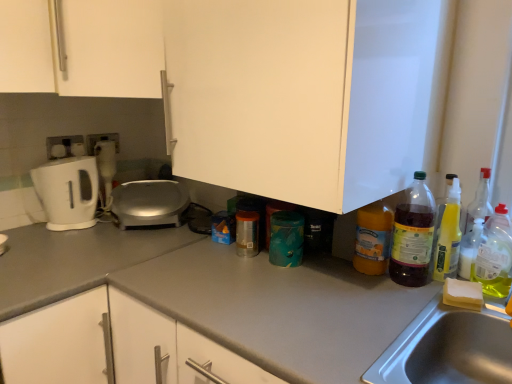
Question: Is translucent plastic spray bottle at right, which is the 3th bottle in left-to-right order, directly adjacent to yellow translucent spray bottle at right, which is the second bottle from right to left?

Choices:
 (A) no
 (B) yes

Answer: (B)

Question: From the image's perspective, does translucent plastic spray bottle at right, the third bottle in the right-to-left sequence, appear lower than yellow translucent spray bottle at right, which is the second bottle from right to left?

Choices:
 (A) yes
 (B) no

Answer: (B)

Question: From the image's perspective, would you say translucent plastic spray bottle at right, the third bottle in the right-to-left sequence, is positioned over yellow translucent spray bottle at right, which ranks as the fourth bottle in left-to-right order?

Choices:
 (A) yes
 (B) no

Answer: (A)

Question: From a real-world perspective, is translucent plastic spray bottle at right, the third bottle in the right-to-left sequence, located beneath yellow translucent spray bottle at right, which ranks as the fourth bottle in left-to-right order?

Choices:
 (A) yes
 (B) no

Answer: (B)

Question: Is translucent plastic spray bottle at right, which is the 3th bottle in left-to-right order, completely or partially outside of yellow translucent spray bottle at right, which ranks as the fourth bottle in left-to-right order?

Choices:
 (A) no
 (B) yes

Answer: (B)

Question: From a real-world perspective, is white glossy electric kettle at left physically located above or below translucent plastic bottle at right, placed as the second bottle when sorted from left to right?

Choices:
 (A) above
 (B) below

Answer: (B)

Question: Considering the positions of white glossy electric kettle at left and translucent plastic bottle at right, placed as the second bottle when sorted from left to right, in the image, is white glossy electric kettle at left wider or thinner than translucent plastic bottle at right, placed as the second bottle when sorted from left to right,?

Choices:
 (A) thin
 (B) wide

Answer: (B)

Question: Is white glossy electric kettle at left inside or outside of translucent plastic bottle at right, placed as the second bottle when sorted from left to right?

Choices:
 (A) outside
 (B) inside

Answer: (A)

Question: Is point (79, 208) closer or farther from the camera than point (413, 261)?

Choices:
 (A) closer
 (B) farther

Answer: (B)

Question: From a real-world perspective, is satin silver appliance at center positioned above or below white glossy electric kettle at left?

Choices:
 (A) above
 (B) below

Answer: (B)

Question: From the image's perspective, relative to white glossy electric kettle at left, is satin silver appliance at center above or below?

Choices:
 (A) below
 (B) above

Answer: (A)

Question: Considering the positions of satin silver appliance at center and white glossy electric kettle at left in the image, is satin silver appliance at center wider or thinner than white glossy electric kettle at left?

Choices:
 (A) thin
 (B) wide

Answer: (B)

Question: Does point (132, 190) appear closer or farther from the camera than point (49, 200)?

Choices:
 (A) closer
 (B) farther

Answer: (B)

Question: Is point (26, 52) closer or farther from the camera than point (472, 251)?

Choices:
 (A) farther
 (B) closer

Answer: (B)

Question: From a real-world perspective, is white matte cabinet at upper left, placed as the 2th cabinetry when sorted from right to left, physically located above or below yellow translucent spray bottle at right, which ranks as the fourth bottle in left-to-right order?

Choices:
 (A) above
 (B) below

Answer: (A)